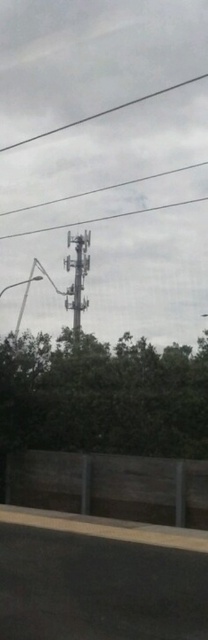
Which is above, green leafy tree at center or metallic gray tower at center?

Positioned higher is metallic gray tower at center.

Find the location of a particular element. This screenshot has height=640, width=208. green leafy tree at center is located at coordinates (104, 396).

You are a GUI agent. You are given a task and a screenshot of the screen. Output one action in this format:
    pyautogui.click(x=<x>, y=<y>)
    Task: Click on the green leafy tree at center
    This screenshot has width=208, height=640.
    Given the screenshot: What is the action you would take?
    pyautogui.click(x=104, y=396)